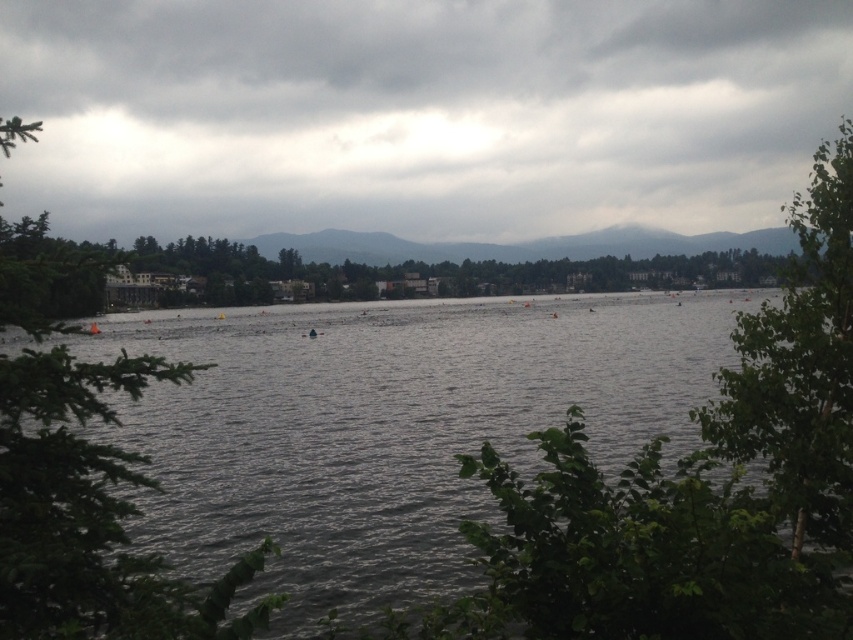
Is green leafy tree at left positioned before green leafy tree at right?

Yes.

Between green leafy tree at left and green leafy tree at right, which one appears on the right side from the viewer's perspective?

Positioned to the right is green leafy tree at right.

Between point (79, 452) and point (833, 525), which one is positioned behind?

The point (833, 525) is more distant.

At what (x,y) coordinates should I click in order to perform the action: click on green leafy tree at left. Please return your answer as a coordinate pair (x, y). This screenshot has height=640, width=853. Looking at the image, I should click on (91, 515).

Does cloudy sky at upper center have a lesser width compared to dark gray water at center?

No.

Is cloudy sky at upper center further to camera compared to dark gray water at center?

Yes, cloudy sky at upper center is further from the viewer.

Who is more distant from viewer, (698, 122) or (380, 308)?

Positioned behind is point (698, 122).

Find the location of a particular element. The height and width of the screenshot is (640, 853). cloudy sky at upper center is located at coordinates (419, 113).

Is dark gray water at center below green leafy tree at left?

Yes.

Does dark gray water at center have a larger size compared to green leafy tree at left?

Correct, dark gray water at center is larger in size than green leafy tree at left.

This screenshot has width=853, height=640. What are the coordinates of `dark gray water at center` in the screenshot? It's located at (389, 428).

This screenshot has height=640, width=853. What are the coordinates of `dark gray water at center` in the screenshot? It's located at (389, 428).